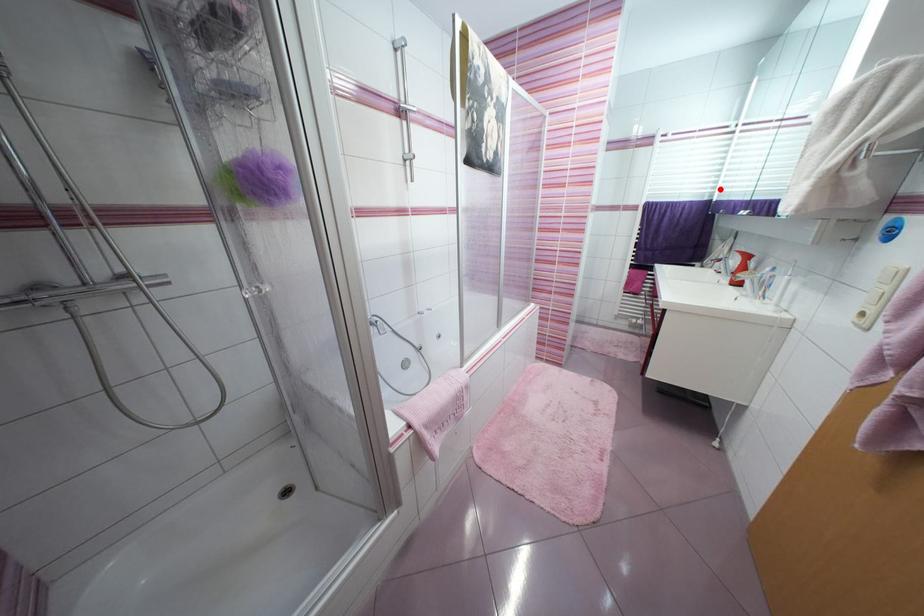
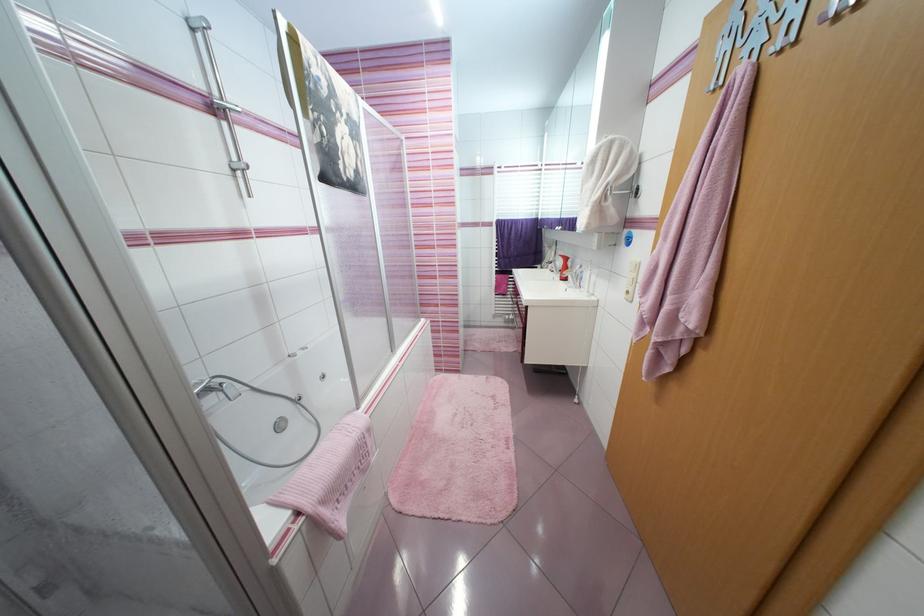
Locate, in the second image, the point that corresponds to the highlighted location in the first image.

(543, 211)